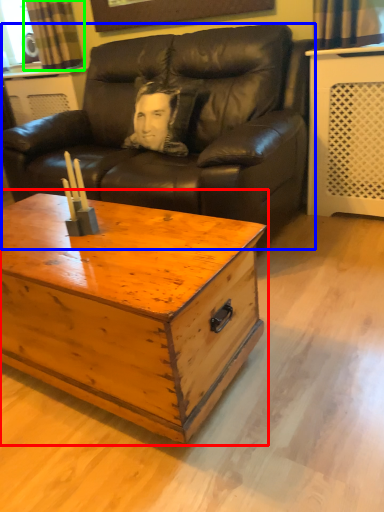
Question: Which is nearer to the coffee table (highlighted by a red box)? studio couch (highlighted by a blue box) or curtain (highlighted by a green box).

Choices:
 (A) studio couch
 (B) curtain

Answer: (A)